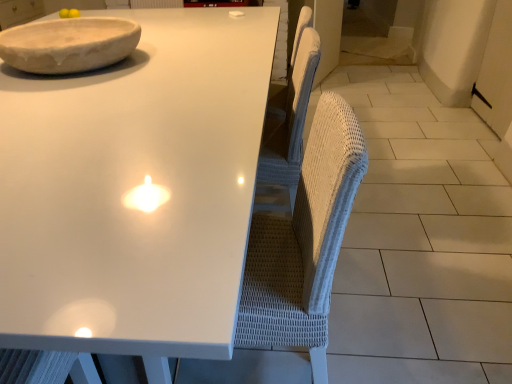
Question: Could you tell me if white wicker swivel chair at center is turned towards white glossy table at upper center?

Choices:
 (A) no
 (B) yes

Answer: (B)

Question: Considering the relative sizes of white wicker swivel chair at center and white glossy table at upper center in the image provided, is white wicker swivel chair at center taller than white glossy table at upper center?

Choices:
 (A) yes
 (B) no

Answer: (A)

Question: Considering the relative sizes of white wicker swivel chair at center and white glossy table at upper center in the image provided, is white wicker swivel chair at center smaller than white glossy table at upper center?

Choices:
 (A) yes
 (B) no

Answer: (A)

Question: Is white glossy table at upper center at the back of white wicker swivel chair at center?

Choices:
 (A) yes
 (B) no

Answer: (A)

Question: From the image's perspective, is white wicker swivel chair at center over white glossy table at upper center?

Choices:
 (A) yes
 (B) no

Answer: (B)

Question: Considering the relative positions of white wicker swivel chair at center and white glossy table at upper center in the image provided, is white wicker swivel chair at center behind white glossy table at upper center?

Choices:
 (A) no
 (B) yes

Answer: (B)

Question: Is the surface of white marble bowl at upper left in direct contact with white wicker swivel chair at center?

Choices:
 (A) yes
 (B) no

Answer: (B)

Question: From a real-world perspective, is white marble bowl at upper left over white wicker swivel chair at center?

Choices:
 (A) no
 (B) yes

Answer: (B)

Question: Does white marble bowl at upper left appear on the right side of white wicker swivel chair at center?

Choices:
 (A) no
 (B) yes

Answer: (A)

Question: Is white marble bowl at upper left shorter than white wicker swivel chair at center?

Choices:
 (A) yes
 (B) no

Answer: (A)

Question: From the image's perspective, is white marble bowl at upper left above white wicker swivel chair at center?

Choices:
 (A) yes
 (B) no

Answer: (A)

Question: Considering the relative sizes of white marble bowl at upper left and white wicker swivel chair at center in the image provided, is white marble bowl at upper left wider than white wicker swivel chair at center?

Choices:
 (A) yes
 (B) no

Answer: (A)

Question: Is white wicker swivel chair at center completely or partially outside of white marble bowl at upper left?

Choices:
 (A) no
 (B) yes

Answer: (B)